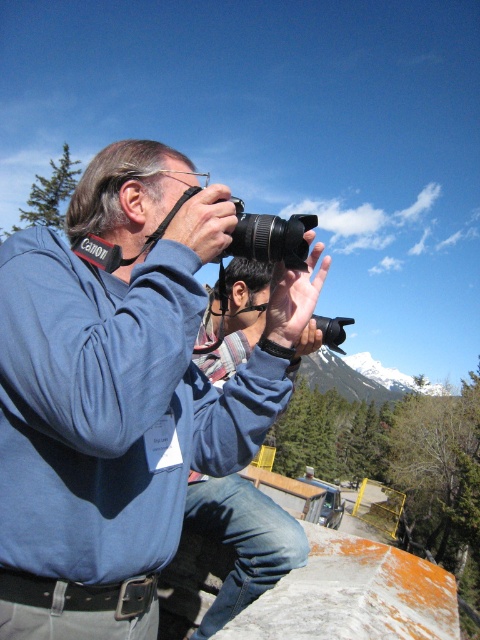
Does point (3, 532) come closer to viewer compared to point (230, 372)?

Yes, point (3, 532) is in front of point (230, 372).

Is matte blue sweatshirt at center wider than blue fabric shirt at center?

Yes, matte blue sweatshirt at center is wider than blue fabric shirt at center.

Who is more distant from viewer, (180, 256) or (205, 522)?

Positioned behind is point (205, 522).

Locate an element on the screen. matte blue sweatshirt at center is located at coordinates (120, 394).

Does blue fabric shirt at center have a greater height compared to black plastic camera at center?

No.

Does blue fabric shirt at center have a greater width compared to black plastic camera at center?

In fact, blue fabric shirt at center might be narrower than black plastic camera at center.

Between point (294, 365) and point (267, 230), which one is positioned in front?

Point (267, 230)

Identify the location of blue fabric shirt at center. The image size is (480, 640). point(241,540).

Between point (34, 326) and point (262, 224), which one is positioned behind?

The point (262, 224) is more distant.

How far apart are matte blue sweatshirt at center and black plastic camera at center?

matte blue sweatshirt at center is 1.39 meters from black plastic camera at center.

Locate an element on the screen. The height and width of the screenshot is (640, 480). matte blue sweatshirt at center is located at coordinates (120, 394).